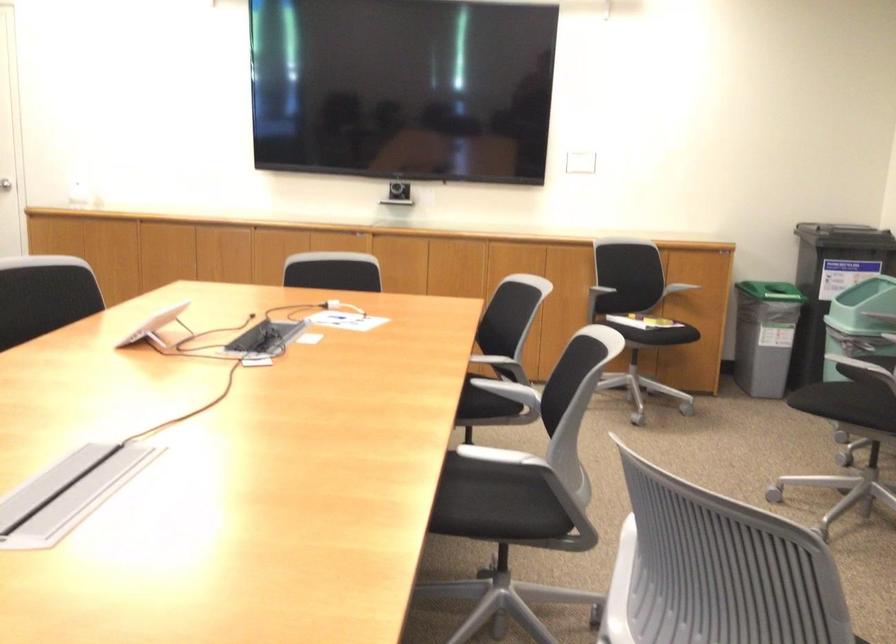
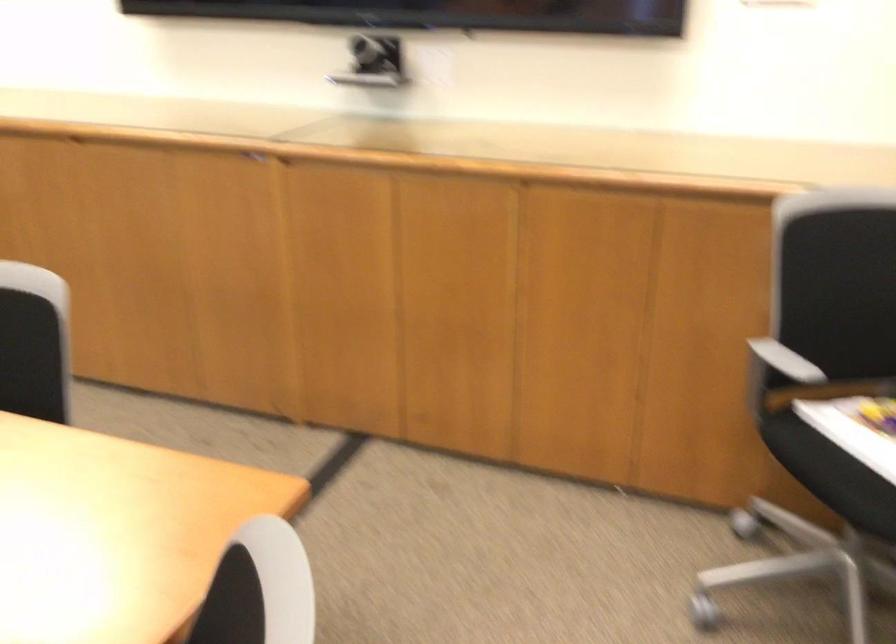
In the second image, find the point that corresponds to the point at 625,301 in the first image.

(857, 428)